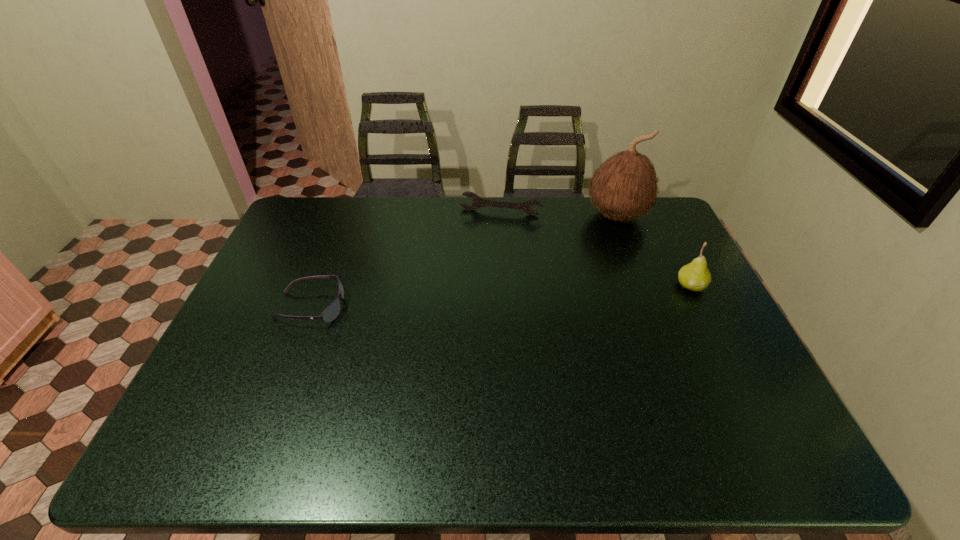
Where is `vacant area that lies between the coconut and the second tallest object`? This screenshot has height=540, width=960. vacant area that lies between the coconut and the second tallest object is located at coordinates (654, 251).

This screenshot has width=960, height=540. Find the location of `vacant point located between the tallest object and the sunglasses`. vacant point located between the tallest object and the sunglasses is located at coordinates (464, 261).

Find the location of `vacant area that lies between the pear and the third tallest object`. vacant area that lies between the pear and the third tallest object is located at coordinates (595, 249).

The image size is (960, 540). Find the location of `empty space between the wrench and the tallest object`. empty space between the wrench and the tallest object is located at coordinates (559, 214).

Locate an element on the screen. This screenshot has width=960, height=540. vacant region between the tallest object and the second tallest object is located at coordinates (654, 251).

The height and width of the screenshot is (540, 960). Find the location of `free spot between the coconut and the leftmost object`. free spot between the coconut and the leftmost object is located at coordinates (464, 261).

The image size is (960, 540). Identify the location of the third closest object to the second tallest object. (332, 311).

You are a GUI agent. You are given a task and a screenshot of the screen. Output one action in this format:
    pyautogui.click(x=<x>, y=<y>)
    Task: Click on the object that is the second closest one to the pear
    
    Given the screenshot: What is the action you would take?
    pyautogui.click(x=478, y=202)

You are a GUI agent. You are given a task and a screenshot of the screen. Output one action in this format:
    pyautogui.click(x=<x>, y=<y>)
    Task: Click on the free space that satisfies the following two spatial constraints: 1. on the front side of the wrench; 2. on the right side of the coconut
    This screenshot has width=960, height=540.
    Given the screenshot: What is the action you would take?
    [x=500, y=215]

At what (x,y) coordinates should I click in order to perform the action: click on free space that satisfies the following two spatial constraints: 1. on the front side of the pear; 2. on the right side of the third object from right to left. Please return your answer as a coordinate pair (x, y). Looking at the image, I should click on (504, 286).